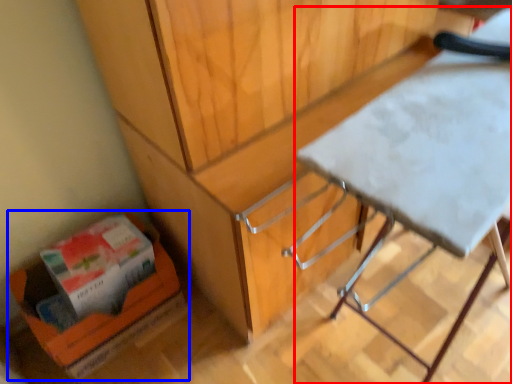
Question: Which object is closer to the camera taking this photo, table (highlighted by a red box) or cardboard box (highlighted by a blue box)?

Choices:
 (A) table
 (B) cardboard box

Answer: (A)